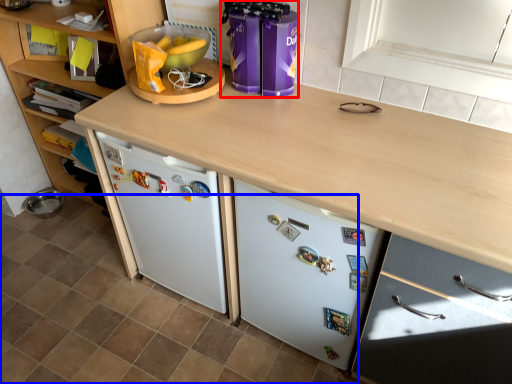
Question: Among these objects, which one is nearest to the camera, appliance (highlighted by a red box) or tile (highlighted by a blue box)?

Choices:
 (A) appliance
 (B) tile

Answer: (B)